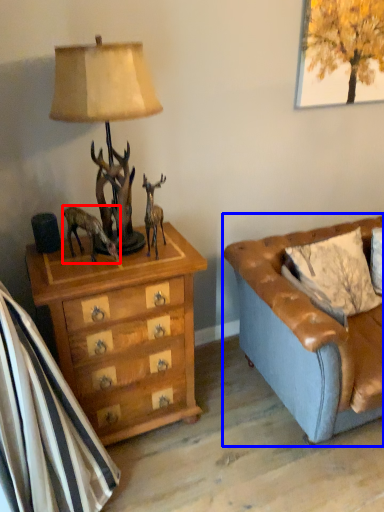
Question: Which point is further to the camera, animal (highlighted by a red box) or studio couch (highlighted by a blue box)?

Choices:
 (A) animal
 (B) studio couch

Answer: (A)